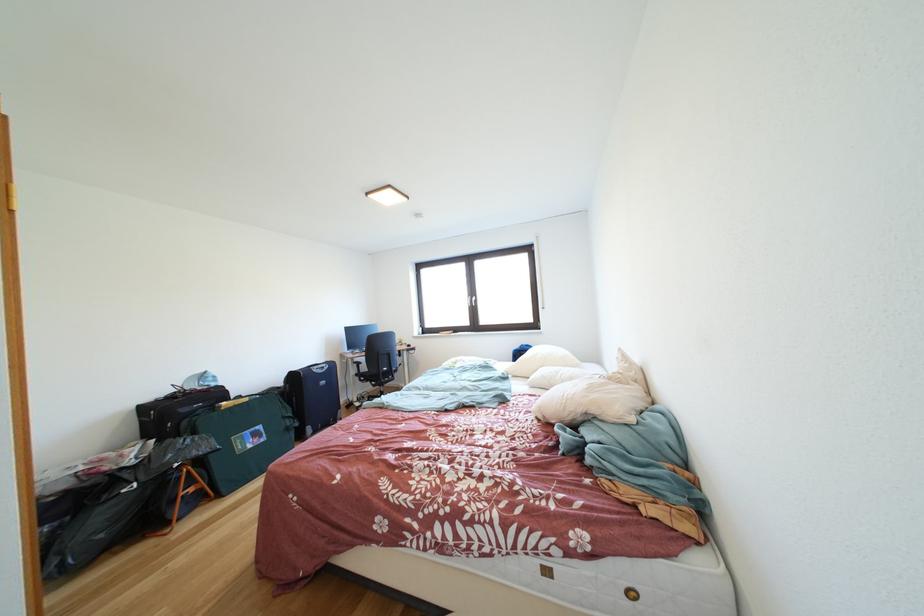
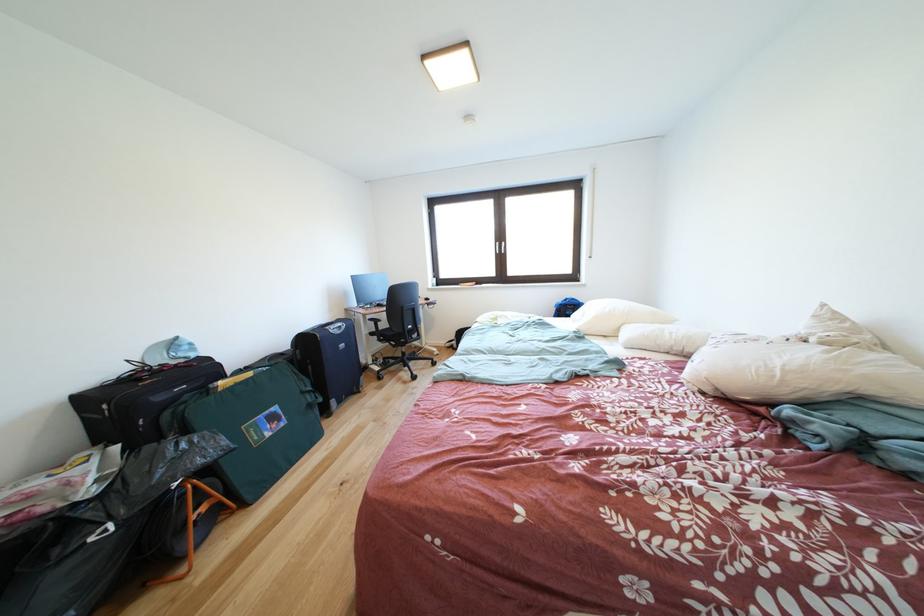
The point at (254, 403) is marked in the first image. Where is the corresponding point in the second image?

(259, 379)